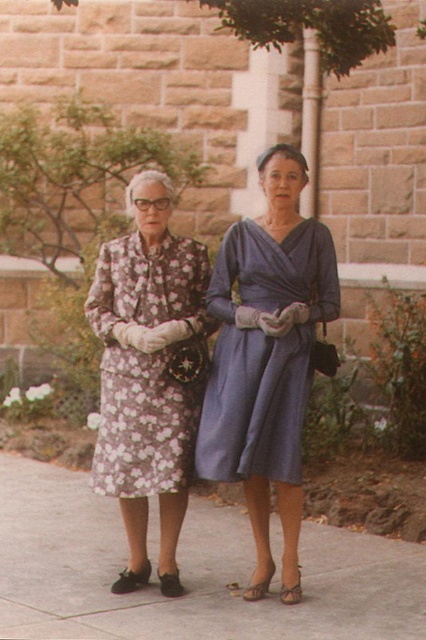
You are taking a photo of two women standing in front of a stone wall. You want to focus on the woman on the left. Which point, point [287,336] or point [169,369], is closer to your camera lens?

Point [287,336] is closer to the camera lens than point [169,369], so you should focus on that point to capture the woman on the left clearly.

You are standing in front of the two women and want to place a small flower pot between the gray concrete pavement at center and the matte blue dress at center. Which object should the flower pot be placed closer to, based on their positions?

The gray concrete pavement at center is closer to the viewer than the matte blue dress at center, so the flower pot should be placed closer to the matte blue dress at center to be between them.

You are standing in front of the two women and want to take a photo of them. The camera you are using has a focal length of 50mm and a sensor size of 24mm x 36mm. The point at coordinate point (357, 579) is 4.65 meters away from you. To ensure both women are in focus, what is the minimum distance you should set the hyperfocal distance on your camera?

The hyperfocal distance is the closest distance at which a lens can be focused while keeping objects at infinity acceptably sharp. To calculate the hyperfocal distance, the formula is HFCalculation. However, since the point at point (357, 579) is 4.65 meters away, you need to ensure that this distance is within the depth of field. The minimum hyperfocal distance required would be less than or equal to 4.65 meters to keep both women in focus.